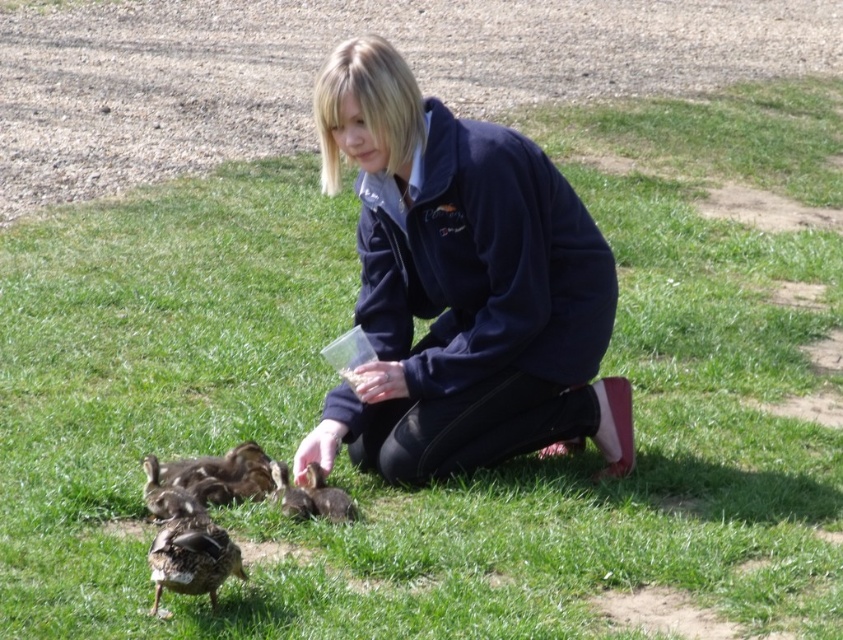
You are standing at the point marked by the coordinates point (x=169, y=492). You want to walk towards the person feeding the ducklings. In which direction should you move?

The brown fuzzy duckling at lower left is represented by point (x=169, y=492). To reach the person feeding the ducklings, you should move towards the upper right direction since the person is likely positioned near the center of the image where the feeding action occurs.